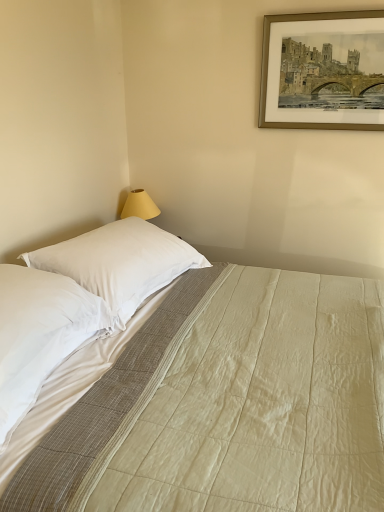
The width and height of the screenshot is (384, 512). What do you see at coordinates (323, 71) in the screenshot? I see `gold metallic picture frame at upper right` at bounding box center [323, 71].

What is the approximate height of gold metallic picture frame at upper right?

The height of gold metallic picture frame at upper right is 22.19 inches.

What do you see at coordinates (39, 334) in the screenshot? Image resolution: width=384 pixels, height=512 pixels. I see `white soft pillow at left, which is counted as the 2th pillow, starting from the back` at bounding box center [39, 334].

Measure the distance between point [226,448] and camera.

The depth of point [226,448] is 3.45 feet.

The width and height of the screenshot is (384, 512). Identify the location of white smooth pillow at upper left, the 1th pillow from the back. (120, 262).

Considering the relative sizes of white smooth pillow at upper left, which appears as the 2th pillow when viewed from the front, and white cotton bed at center in the image provided, is white smooth pillow at upper left, which appears as the 2th pillow when viewed from the front, smaller than white cotton bed at center?

Yes.

Which object is closer to the camera taking this photo, white smooth pillow at upper left, which appears as the 2th pillow when viewed from the front, or white cotton bed at center?

white cotton bed at center.

Considering the sizes of objects white smooth pillow at upper left, the 1th pillow from the back, and white cotton bed at center in the image provided, who is taller, white smooth pillow at upper left, the 1th pillow from the back, or white cotton bed at center?

white cotton bed at center.

Considering the positions of point (171, 274) and point (135, 314), is point (171, 274) closer or farther from the camera than point (135, 314)?

Clearly, point (171, 274) is more distant from the camera than point (135, 314).

In terms of width, does gold metallic picture frame at upper right look wider or thinner when compared to white smooth pillow at upper left, which appears as the 2th pillow when viewed from the front?

In the image, gold metallic picture frame at upper right appears to be more narrow than white smooth pillow at upper left, which appears as the 2th pillow when viewed from the front.

Is gold metallic picture frame at upper right not near white smooth pillow at upper left, the 1th pillow from the back?

That's right, there is a large distance between gold metallic picture frame at upper right and white smooth pillow at upper left, the 1th pillow from the back.

Which point is more forward, (309, 46) or (111, 255)?

Point (111, 255)

From a real-world perspective, is gold metallic picture frame at upper right above or below white smooth pillow at upper left, the 1th pillow from the back?

Answer: Clearly, from a real-world perspective, gold metallic picture frame at upper right is above white smooth pillow at upper left, the 1th pillow from the back.

From the image's perspective, which object appears higher, white cotton bed at center or white smooth pillow at upper left, the 1th pillow from the back?

white smooth pillow at upper left, the 1th pillow from the back, from the image's perspective.

Would you say white cotton bed at center is a long distance from white smooth pillow at upper left, the 1th pillow from the back?

They are positioned close to each other.

Is white cotton bed at center behind white smooth pillow at upper left, the 1th pillow from the back?

No, it is not.

Who is bigger, white cotton bed at center or white smooth pillow at upper left, the 1th pillow from the back?

white cotton bed at center.

The height and width of the screenshot is (512, 384). I want to click on picture frame located behind the white soft pillow at left, which is counted as the 2th pillow, starting from the back, so click(323, 71).

Considering the relative positions of white soft pillow at left, which is counted as the 2th pillow, starting from the back, and gold metallic picture frame at upper right in the image provided, is white soft pillow at left, which is counted as the 2th pillow, starting from the back, to the left of gold metallic picture frame at upper right from the viewer's perspective?

Indeed, white soft pillow at left, which is counted as the 2th pillow, starting from the back, is positioned on the left side of gold metallic picture frame at upper right.

Is white soft pillow at left, arranged as the first pillow when viewed from the front, facing away from gold metallic picture frame at upper right?

white soft pillow at left, arranged as the first pillow when viewed from the front, does not have its back to gold metallic picture frame at upper right.

Which of these two, white soft pillow at left, which is counted as the 2th pillow, starting from the back, or gold metallic picture frame at upper right, is smaller?

With smaller size is gold metallic picture frame at upper right.

What's the angular difference between gold metallic picture frame at upper right and white cotton bed at center's facing directions?

The facing directions of gold metallic picture frame at upper right and white cotton bed at center are 89.7 degrees apart.

From a real-world perspective, between gold metallic picture frame at upper right and white cotton bed at center, who is vertically lower?

white cotton bed at center, from a real-world perspective.

Could white cotton bed at center be considered to be inside gold metallic picture frame at upper right?

No, gold metallic picture frame at upper right does not contain white cotton bed at center.

This screenshot has height=512, width=384. Identify the location of picture frame that appears above the white cotton bed at center (from the image's perspective). (323, 71).

Considering the sizes of objects white smooth pillow at upper left, the 1th pillow from the back, and gold metallic picture frame at upper right in the image provided, who is taller, white smooth pillow at upper left, the 1th pillow from the back, or gold metallic picture frame at upper right?

With more height is gold metallic picture frame at upper right.

Does white smooth pillow at upper left, the 1th pillow from the back, come in front of gold metallic picture frame at upper right?

Yes.

Is gold metallic picture frame at upper right to the left or to the right of white soft pillow at left, arranged as the first pillow when viewed from the front, in the image?

gold metallic picture frame at upper right is positioned on white soft pillow at left, arranged as the first pillow when viewed from the front,'s right side.

Based on their sizes in the image, would you say gold metallic picture frame at upper right is bigger or smaller than white soft pillow at left, arranged as the first pillow when viewed from the front?

gold metallic picture frame at upper right is smaller than white soft pillow at left, arranged as the first pillow when viewed from the front.

Which of these two, gold metallic picture frame at upper right or white soft pillow at left, which is counted as the 2th pillow, starting from the back, stands taller?

Standing taller between the two is gold metallic picture frame at upper right.

From a real-world perspective, does gold metallic picture frame at upper right sit lower than white soft pillow at left, arranged as the first pillow when viewed from the front?

No, from a real-world perspective, gold metallic picture frame at upper right is not below white soft pillow at left, arranged as the first pillow when viewed from the front.

Image resolution: width=384 pixels, height=512 pixels. I want to click on bed that is in front of the white smooth pillow at upper left, the 1th pillow from the back, so click(195, 383).

Identify the location of picture frame located behind the white smooth pillow at upper left, the 1th pillow from the back. Image resolution: width=384 pixels, height=512 pixels. (323, 71).

Looking at the image, which one is located further to white cotton bed at center, gold metallic picture frame at upper right or white soft pillow at left, which is counted as the 2th pillow, starting from the back?

Based on the image, gold metallic picture frame at upper right appears to be further to white cotton bed at center.

Looking at the image, which one is located further to gold metallic picture frame at upper right, white cotton bed at center or white smooth pillow at upper left, which appears as the 2th pillow when viewed from the front?

Among the two, white cotton bed at center is located further to gold metallic picture frame at upper right.

Looking at this image, when comparing their distances from white cotton bed at center, does white soft pillow at left, arranged as the first pillow when viewed from the front, or gold metallic picture frame at upper right seem further?

The object further to white cotton bed at center is gold metallic picture frame at upper right.

Which object lies further to the anchor point white cotton bed at center, white soft pillow at left, which is counted as the 2th pillow, starting from the back, or white smooth pillow at upper left, the 1th pillow from the back?

The object further to white cotton bed at center is white soft pillow at left, which is counted as the 2th pillow, starting from the back.

From the picture: From the image, which object appears to be nearer to white smooth pillow at upper left, the 1th pillow from the back, white cotton bed at center or gold metallic picture frame at upper right?

white cotton bed at center is closer to white smooth pillow at upper left, the 1th pillow from the back.

Estimate the real-world distances between objects in this image. Which object is further from gold metallic picture frame at upper right, white soft pillow at left, arranged as the first pillow when viewed from the front, or white cotton bed at center?

Among the two, white soft pillow at left, arranged as the first pillow when viewed from the front, is located further to gold metallic picture frame at upper right.

From the picture: Looking at the image, which one is located further to gold metallic picture frame at upper right, white smooth pillow at upper left, the 1th pillow from the back, or white soft pillow at left, arranged as the first pillow when viewed from the front?

white soft pillow at left, arranged as the first pillow when viewed from the front, is positioned further to the anchor gold metallic picture frame at upper right.

When comparing their distances from white cotton bed at center, does gold metallic picture frame at upper right or white smooth pillow at upper left, which appears as the 2th pillow when viewed from the front, seem closer?

white smooth pillow at upper left, which appears as the 2th pillow when viewed from the front, lies closer to white cotton bed at center than the other object.

Find the location of `pillow between gold metallic picture frame at upper right and white soft pillow at left, arranged as the first pillow when viewed from the front, in the up-down direction`. pillow between gold metallic picture frame at upper right and white soft pillow at left, arranged as the first pillow when viewed from the front, in the up-down direction is located at coordinates (120, 262).

At what (x,y) coordinates should I click in order to perform the action: click on pillow located between white cotton bed at center and white smooth pillow at upper left, the 1th pillow from the back, in the depth direction. Please return your answer as a coordinate pair (x, y). This screenshot has width=384, height=512. Looking at the image, I should click on coord(39,334).